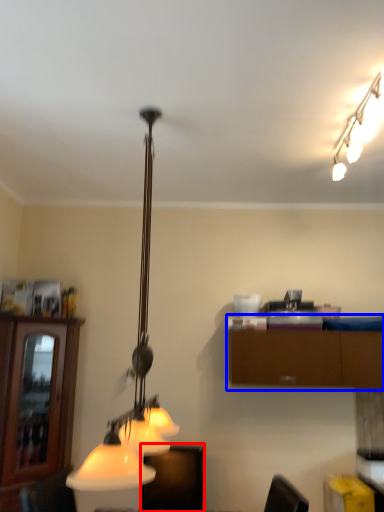
Question: Which object appears farthest to the camera in this image, furniture (highlighted by a red box) or cabinetry (highlighted by a blue box)?

Choices:
 (A) furniture
 (B) cabinetry

Answer: (B)